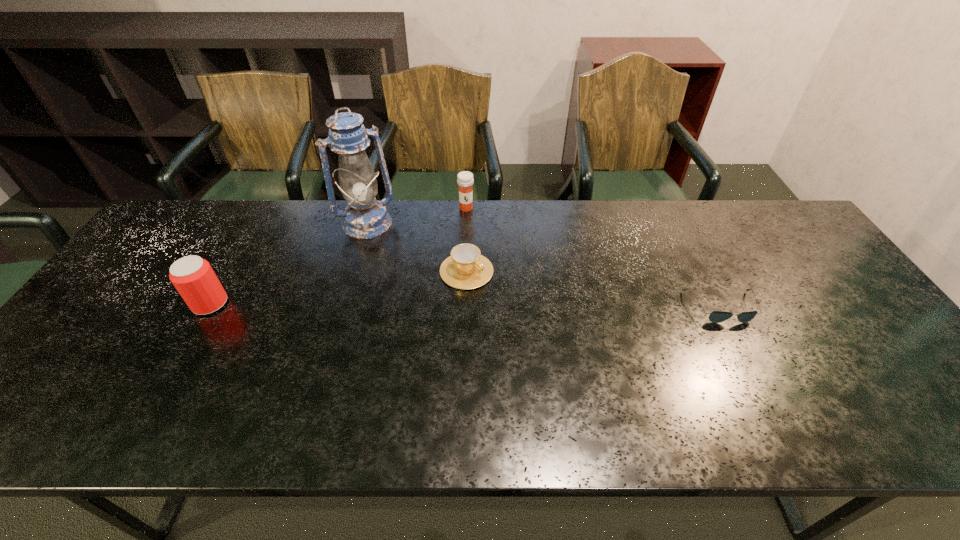
Identify the location of free space on the desktop that is between the beer can and the shortest object and is positioned on the front-facing side of the tallest object. This screenshot has height=540, width=960. (411, 305).

Identify the location of free spot on the desktop that is between the beer can and the shortest object and is positioned with the handle on the side of the third farthest object. The image size is (960, 540). (525, 306).

Locate an element on the screen. free space on the desktop that is between the beer can and the rightmost object and is positioned on the label side of the medicine is located at coordinates click(x=456, y=305).